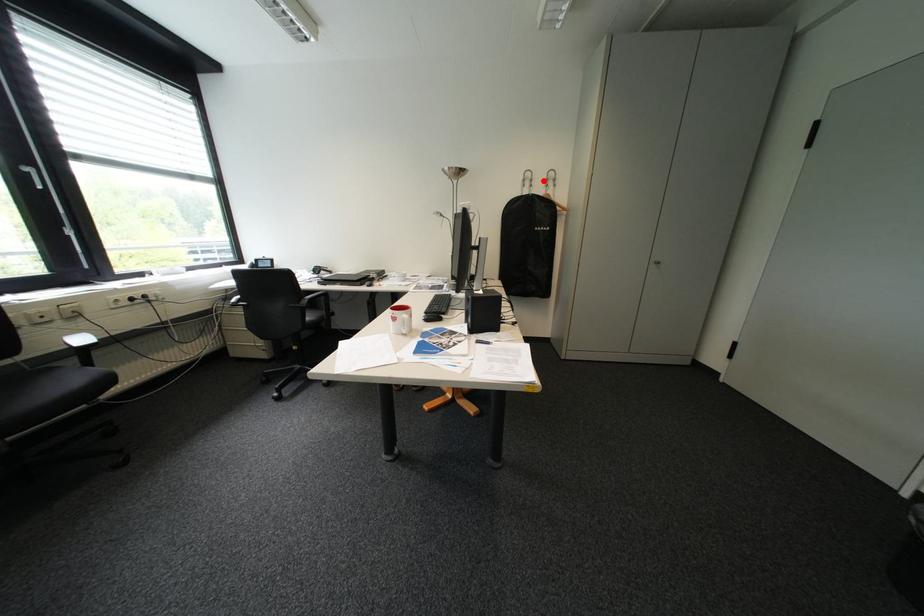
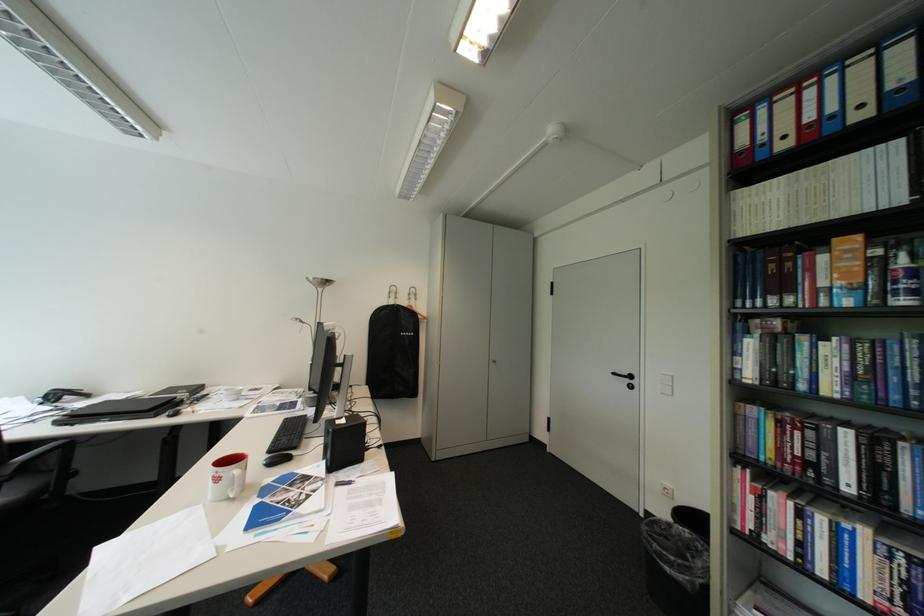
Find the pixel in the second image that matches the highlighted location in the first image.

(408, 294)